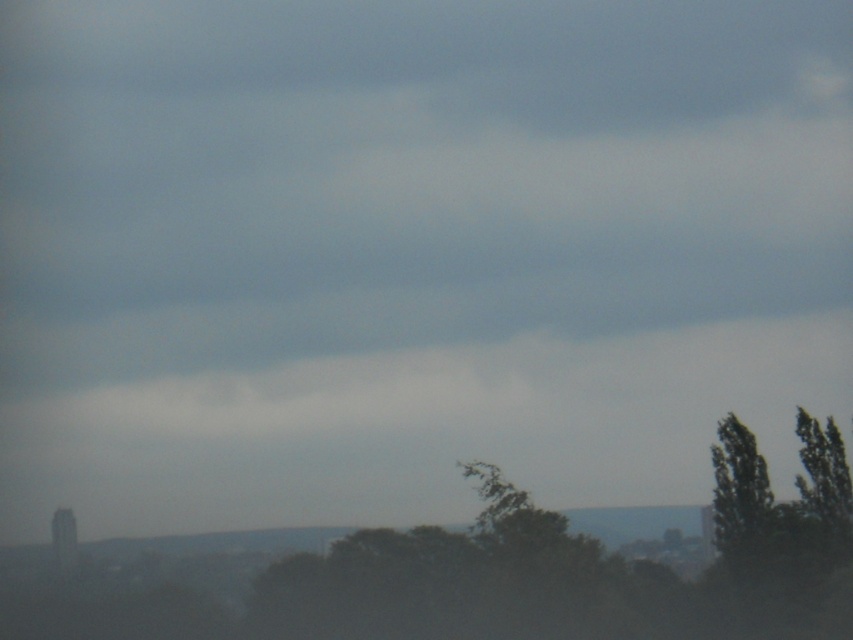
You are an observer standing in the landscape described. You notice two trees in the scene. Which tree is positioned lower in the image, the green matte tree at center or the green leafy tree at right?

The green matte tree at center is located below the green leafy tree at right, so it is positioned lower in the image.

You are standing in the landscape scene and want to walk towards the two points marked in the image. Which point, point (x=657, y=586) or point (x=769, y=499), will you reach first?

You will reach point (x=657, y=586) first because it is closer to the viewer than point (x=769, y=499).

Based on the photo, you are an environmental scientist assessing a forest area. You observe the green matte tree at center and the green leafy tree at right. Based on their sizes, which tree is more likely to be the dominant species in this forest ecosystem?

The green matte tree at center is larger in size than the green leafy tree at right, so it is more likely to be the dominant species in this forest ecosystem.